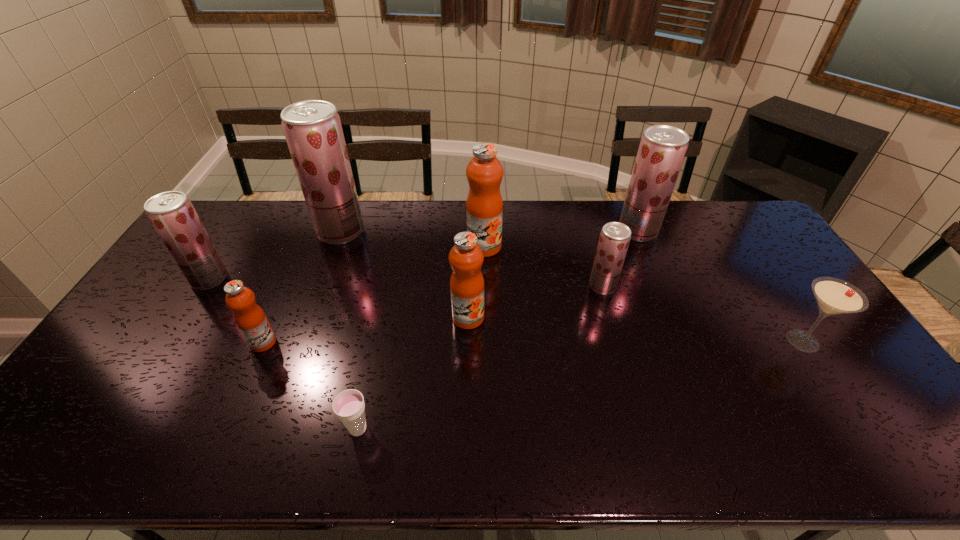
At what (x,y) coordinates should I click in order to perform the action: click on the biggest strawberry fruit juice. Please return your answer as a coordinate pair (x, y). Looking at the image, I should click on (312, 128).

The image size is (960, 540). In order to click on the third strawberry fruit juice from right to left in this screenshot , I will do `click(312, 128)`.

The height and width of the screenshot is (540, 960). In order to click on the rightmost strawberry fruit juice in this screenshot , I will do `click(662, 149)`.

This screenshot has width=960, height=540. Identify the location of the rightmost fruit juice. (662, 149).

Locate an element on the screen. the farthest orange fruit juice is located at coordinates (484, 207).

This screenshot has height=540, width=960. I want to click on the second smallest strawberry fruit juice, so click(x=171, y=213).

This screenshot has height=540, width=960. I want to click on the leftmost fruit juice, so click(x=171, y=213).

Locate an element on the screen. Image resolution: width=960 pixels, height=540 pixels. the second farthest orange fruit juice is located at coordinates (466, 258).

In order to click on the second nearest fruit juice in this screenshot , I will do `click(466, 258)`.

This screenshot has height=540, width=960. I want to click on the smallest strawberry fruit juice, so click(614, 240).